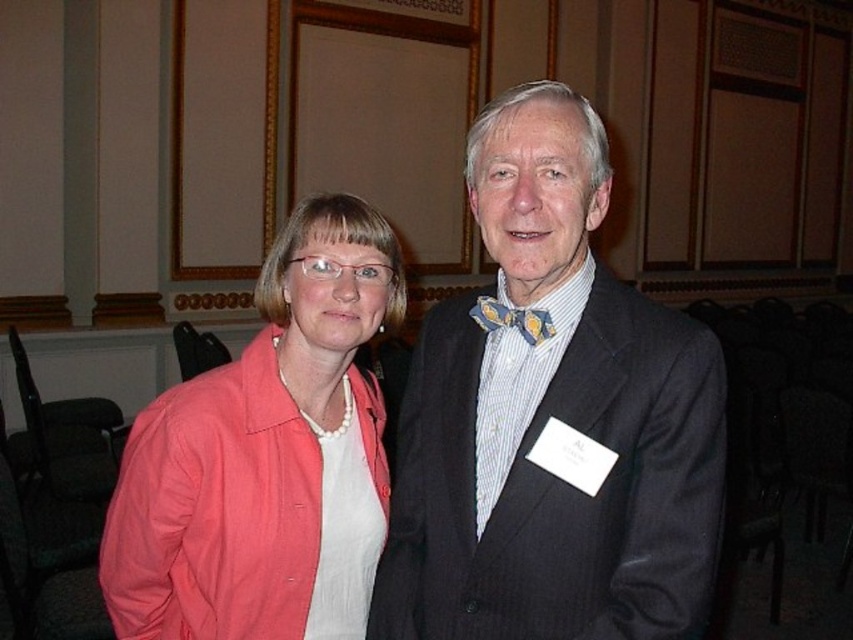
Question: Which point appears farthest from the camera in this image?

Choices:
 (A) (274, 632)
 (B) (688, 592)

Answer: (A)

Question: Is matte black suit at center positioned behind coral fabric jacket at left?

Choices:
 (A) yes
 (B) no

Answer: (B)

Question: Among these points, which one is farthest from the camera?

Choices:
 (A) (322, 516)
 (B) (692, 534)

Answer: (A)

Question: Is matte black suit at center positioned before coral fabric jacket at left?

Choices:
 (A) yes
 (B) no

Answer: (A)

Question: Does matte black suit at center appear under coral fabric jacket at left?

Choices:
 (A) yes
 (B) no

Answer: (B)

Question: Which point appears farthest from the camera in this image?

Choices:
 (A) (488, 339)
 (B) (260, 500)

Answer: (A)